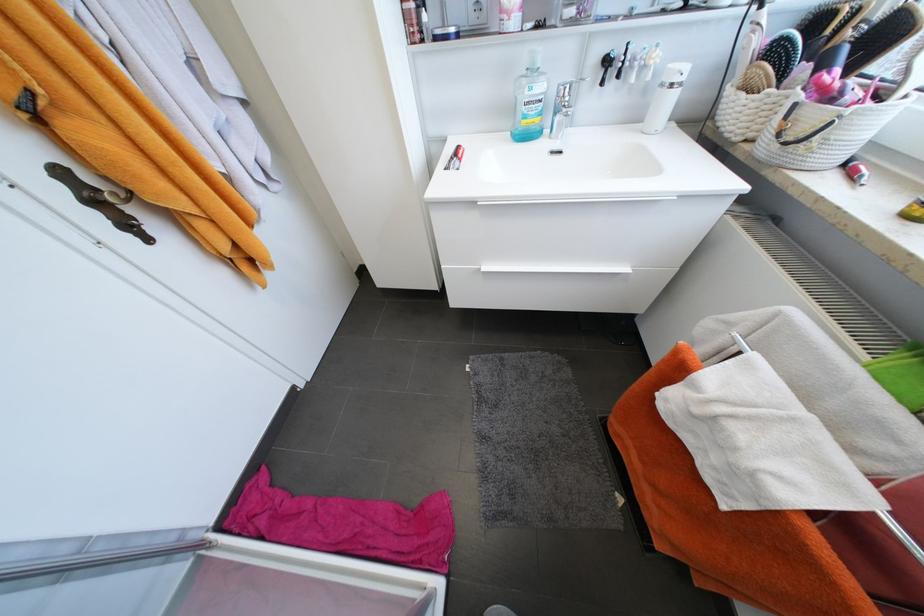
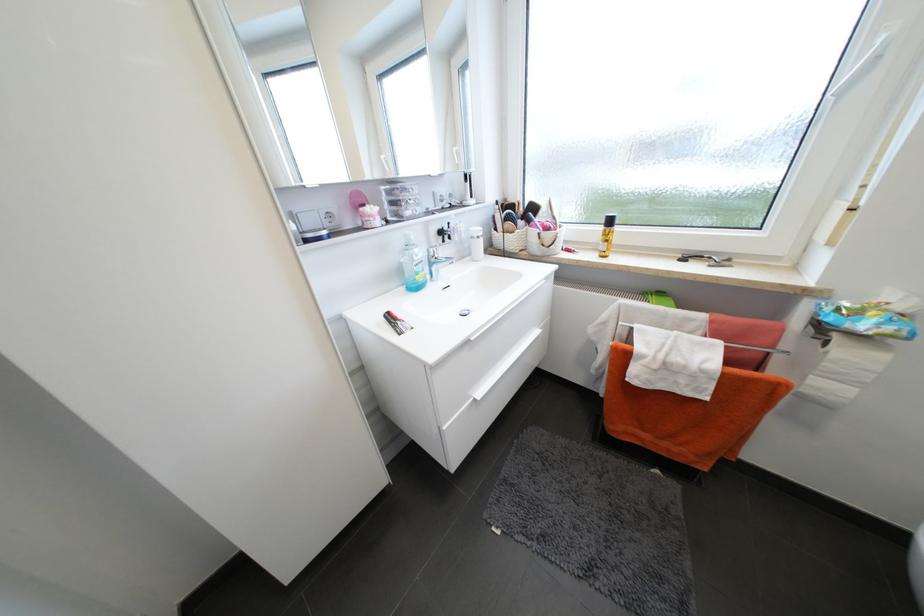
Where in the second image is the point corresponding to [667,86] from the first image?

(478, 238)